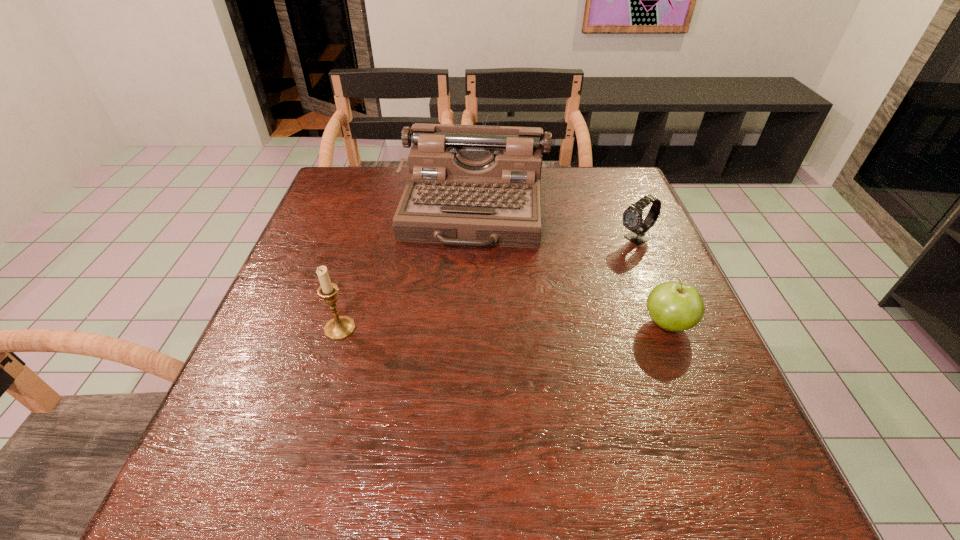
Find the location of `vacant spot on the desktop that is between the leftmost object and the apple and is positioned on the keyboard of the typewriter`. vacant spot on the desktop that is between the leftmost object and the apple and is positioned on the keyboard of the typewriter is located at coordinates (456, 327).

Find the location of a particular element. The width and height of the screenshot is (960, 540). free space on the desktop that is between the candle holder and the apple and is positioned on the face of the watch is located at coordinates (456, 327).